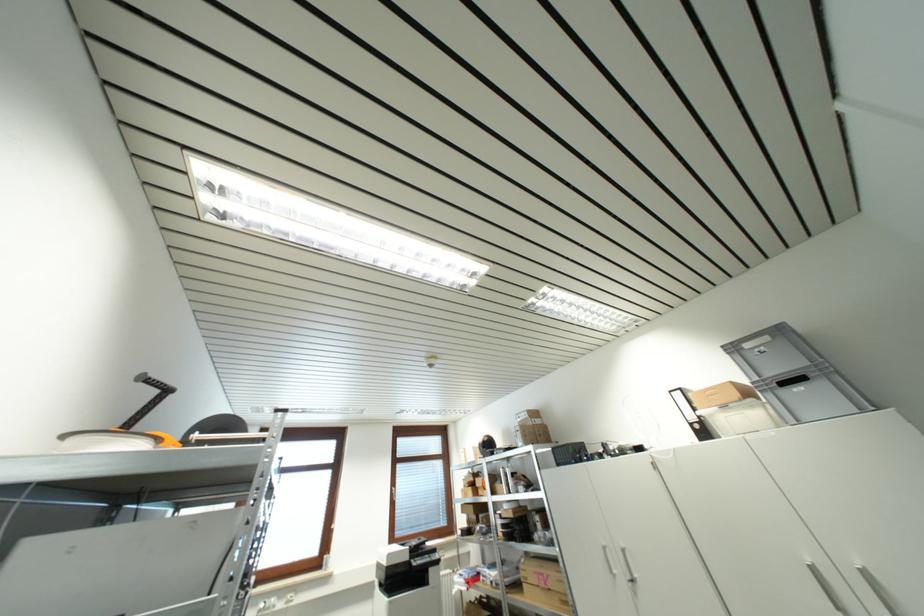
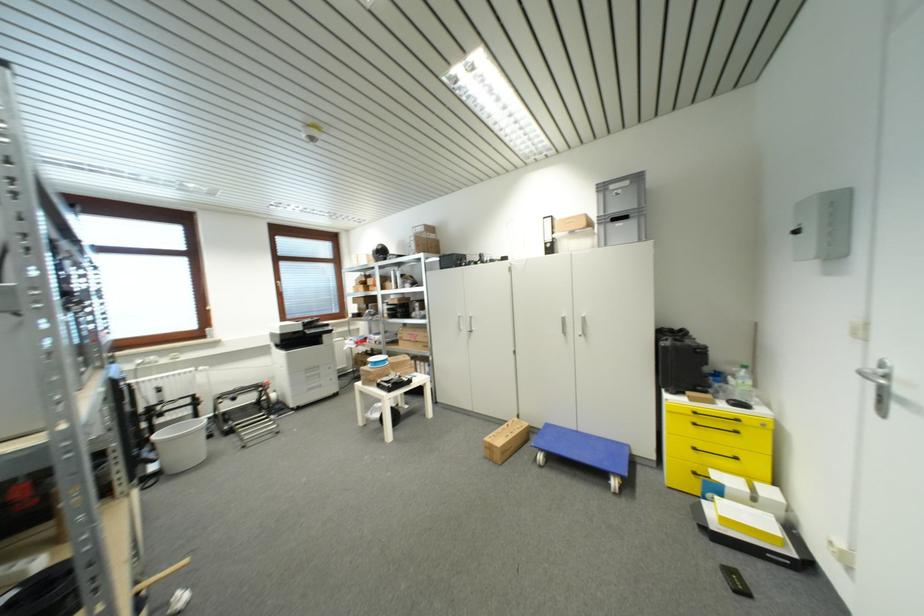
Locate, in the second image, the point that corresponds to pixel 751 349 in the first image.

(616, 190)